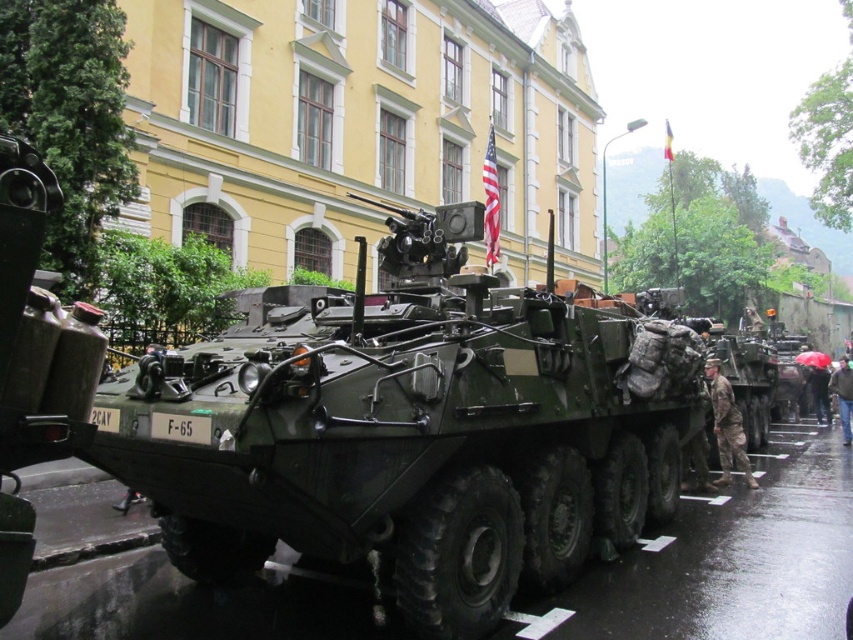
You are a military observer positioned at the origin point of the coordinate system. You need to determine the position of the matte green armored vehicle at center relative to your current location. What are its coordinates?

The matte green armored vehicle at center is located at coordinates point [415,429].

You are a photographer trying to capture both the camouflage fabric uniform at center and the camouflage fabric soldier at lower right in a single frame. Given their sizes, which object should you zoom in on to ensure both fit in the frame without cropping?

Since the camouflage fabric uniform at center is narrower than the camouflage fabric soldier at lower right, you should zoom in on the camouflage fabric soldier at lower right to accommodate its larger width in the frame.